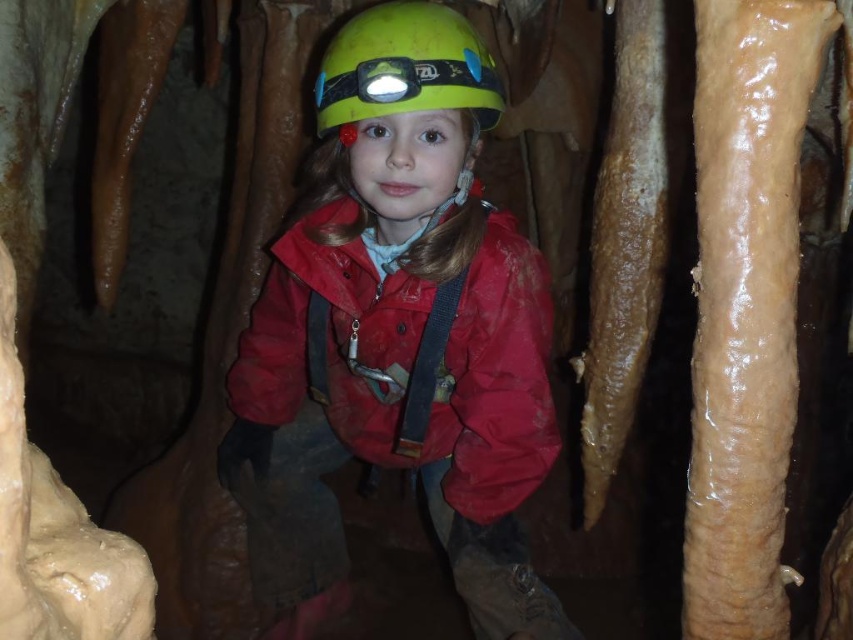
Consider the image. You are planning to pack a backpack for a cave exploration trip. You have both the matte red jacket at center and the yellow matte helmet at center. Given their sizes, which item should you prioritize packing first to ensure it fits in your backpack?

The matte red jacket at center has a larger size compared to the yellow matte helmet at center, so you should prioritize packing the matte red jacket at center first to ensure it fits in your backpack.

You are a cave explorer wearing a matte red jacket at center and a green matte helmet at center. You need to pass through a narrow cave opening. Which item will you need to adjust first to fit through the space?

The matte red jacket at center has a larger size compared to the green matte helmet at center, so you would need to adjust the matte red jacket at center first to fit through the narrow opening.

You are a cave explorer wearing both the yellow matte helmet at center and the green matte helmet at center. Which helmet takes up more space on your head?

The yellow matte helmet at center takes up more space on your head because it is bigger than the green matte helmet at center.